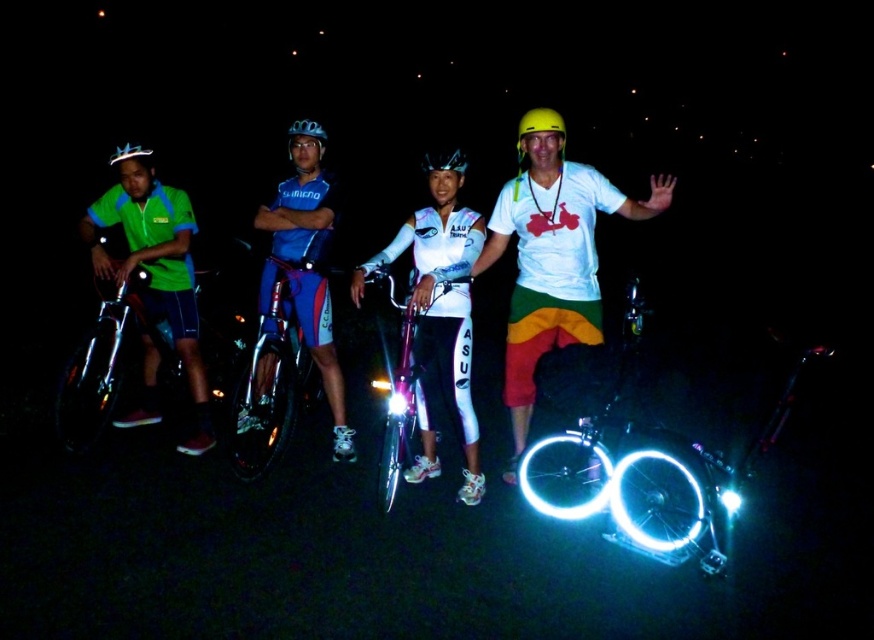
Question: Can you confirm if green fabric shirt at left is wider than yellow matte helmet at center?

Choices:
 (A) no
 (B) yes

Answer: (A)

Question: Does white reflective wheels at center have a smaller size compared to matte blue helmet at upper center?

Choices:
 (A) no
 (B) yes

Answer: (A)

Question: Is white reflective wheels at center thinner than matte black helmet at upper left?

Choices:
 (A) yes
 (B) no

Answer: (B)

Question: Which object is positioned farthest from the white matte t-shirt at center?

Choices:
 (A) matte black helmet at upper center
 (B) shiny blue frame at center

Answer: (B)

Question: Considering the real-world distances, which object is farthest from the matte blue helmet at upper center?

Choices:
 (A) yellow matte helmet at center
 (B) green fabric shirt at left

Answer: (A)

Question: Which point is farther from the camera taking this photo?

Choices:
 (A) (593, 490)
 (B) (132, 157)

Answer: (B)